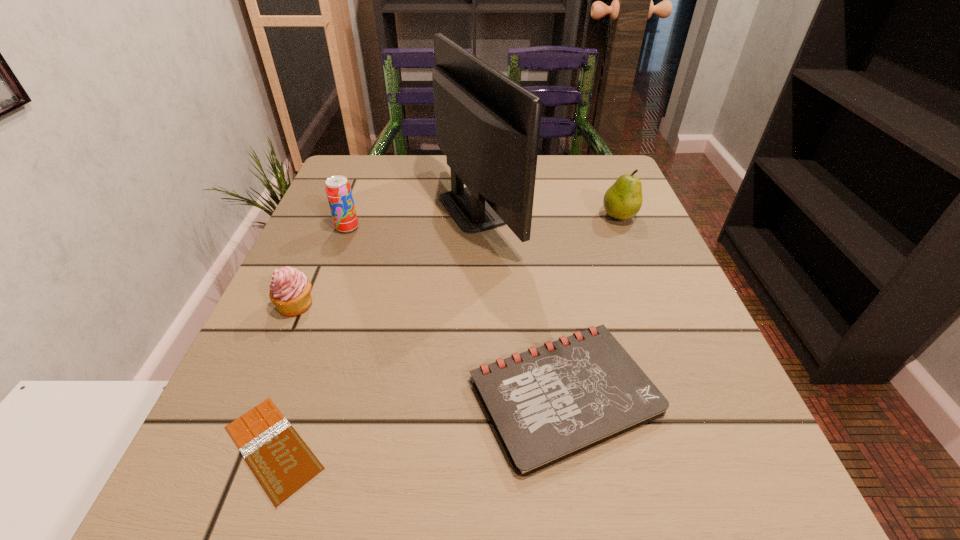
Image resolution: width=960 pixels, height=540 pixels. I want to click on free spot between the pear and the chocolate bar, so click(x=446, y=332).

The height and width of the screenshot is (540, 960). I want to click on vacant area that lies between the cupcake and the soda can, so click(322, 266).

At what (x,y) coordinates should I click in order to perform the action: click on free space between the cupcake and the computer monitor. Please return your answer as a coordinate pair (x, y). Looking at the image, I should click on (387, 256).

What are the coordinates of `vacant space that's between the fourth tallest object and the soda can` in the screenshot? It's located at (322, 266).

The width and height of the screenshot is (960, 540). Find the location of `the closest object to the notebook`. the closest object to the notebook is located at coordinates (488, 126).

Select which object appears as the third closest to the shortest object. Please provide its 2D coordinates. Your answer should be formatted as a tuple, i.e. [(x, y)], where the tuple contains the x and y coordinates of a point satisfying the conditions above.

[(488, 126)]

This screenshot has width=960, height=540. I want to click on vacant region that satisfies the following two spatial constraints: 1. on the back side of the third nearest object; 2. on the right side of the pear, so click(334, 216).

Locate an element on the screen. vacant area that satisfies the following two spatial constraints: 1. on the front-facing side of the computer monitor; 2. on the back side of the pear is located at coordinates (478, 216).

Find the location of a particular element. vacant region that satisfies the following two spatial constraints: 1. on the front-facing side of the pear; 2. on the left side of the computer monitor is located at coordinates (x=478, y=216).

Where is `free space that satisfies the following two spatial constraints: 1. on the back side of the rightmost object; 2. on the front-facing side of the tallest object`? free space that satisfies the following two spatial constraints: 1. on the back side of the rightmost object; 2. on the front-facing side of the tallest object is located at coordinates (615, 208).